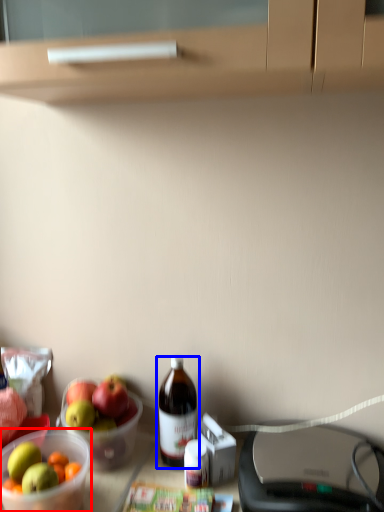
Question: Among these objects, which one is farthest to the camera, bowl (highlighted by a red box) or bottle (highlighted by a blue box)?

Choices:
 (A) bowl
 (B) bottle

Answer: (B)